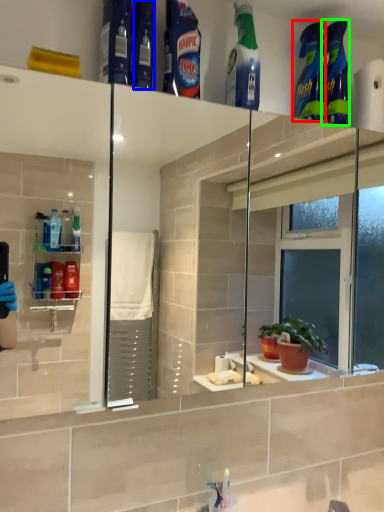
Question: Which object is positioned closest to cleaning product (highlighted by a red box)? Select from toiletry (highlighted by a blue box) and cleaning product (highlighted by a green box).

Choices:
 (A) toiletry
 (B) cleaning product

Answer: (B)